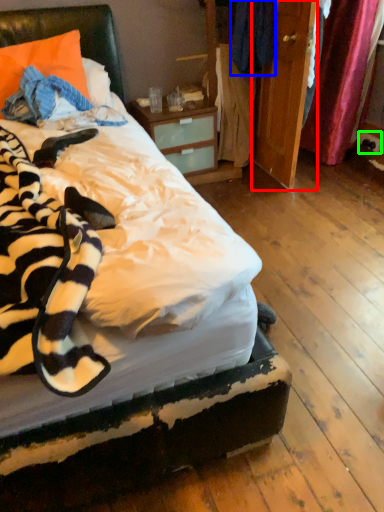
Question: Which object is the farthest from armoire (highlighted by a red box)? Choose among these: clothing (highlighted by a blue box) or power outlet (highlighted by a green box).

Choices:
 (A) clothing
 (B) power outlet

Answer: (B)